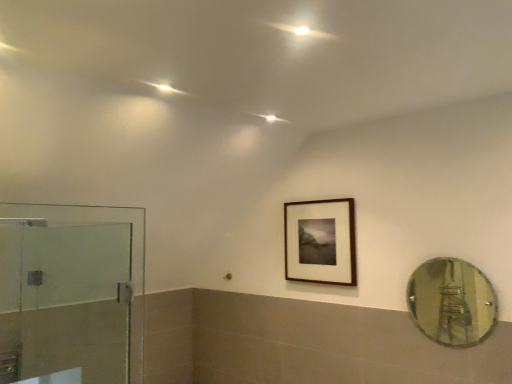
At what (x,y) coordinates should I click in order to perform the action: click on transparent glass shower door at left. Please return your answer as a coordinate pair (x, y). Looking at the image, I should click on (71, 293).

Find the location of a particular element. This screenshot has height=384, width=512. wooden frame at upper center is located at coordinates (320, 241).

From a real-world perspective, between transparent glass shower door at left and wooden frame at upper center, who is vertically lower?

transparent glass shower door at left is physically lower.

Does point (128, 327) come closer to viewer compared to point (314, 231)?

No, it is behind (314, 231).

Are transparent glass shower door at left and wooden frame at upper center beside each other?

They are not placed beside each other.

Which object is wider, transparent glass shower door at left or clear glass mirror at right?

With larger width is transparent glass shower door at left.

Which is behind, point (74, 300) or point (474, 296)?

The point (74, 300) is behind.

Is transparent glass shower door at left inside or outside of clear glass mirror at right?

transparent glass shower door at left is outside clear glass mirror at right.

The width and height of the screenshot is (512, 384). I want to click on screen door that appears above the clear glass mirror at right (from a real-world perspective), so click(71, 293).

Is wooden frame at upper center aimed at transparent glass shower door at left?

Yes, wooden frame at upper center is facing transparent glass shower door at left.

From a real-world perspective, is wooden frame at upper center over transparent glass shower door at left?

Indeed, from a real-world perspective, wooden frame at upper center stands above transparent glass shower door at left.

Based on the photo, which is in front, wooden frame at upper center or transparent glass shower door at left?

transparent glass shower door at left is closer to the camera.

Which is in front, point (315, 202) or point (455, 334)?

The point (455, 334) is closer to the camera.

Between wooden frame at upper center and clear glass mirror at right, which one has less height?

Standing shorter between the two is clear glass mirror at right.

Considering the relative sizes of wooden frame at upper center and clear glass mirror at right in the image provided, is wooden frame at upper center wider than clear glass mirror at right?

Yes.

Based on their sizes in the image, would you say wooden frame at upper center is bigger or smaller than clear glass mirror at right?

Considering their sizes, wooden frame at upper center takes up more space than clear glass mirror at right.

Considering the sizes of objects clear glass mirror at right and wooden frame at upper center in the image provided, who is wider, clear glass mirror at right or wooden frame at upper center?

With larger width is wooden frame at upper center.

Is point (431, 264) closer or farther from the camera than point (339, 207)?

Point (431, 264).

Consider the image. Is clear glass mirror at right not inside wooden frame at upper center?

clear glass mirror at right is positioned outside wooden frame at upper center.

From a real-world perspective, who is located lower, clear glass mirror at right or wooden frame at upper center?

clear glass mirror at right, from a real-world perspective.

At what (x,y) coordinates should I click in order to perform the action: click on mirror on the right of transparent glass shower door at left. Please return your answer as a coordinate pair (x, y). The height and width of the screenshot is (384, 512). Looking at the image, I should click on (452, 302).

Is point (432, 288) behind point (69, 341)?

That is False.

Is transparent glass shower door at left at the back of clear glass mirror at right?

No, transparent glass shower door at left is not at the back of clear glass mirror at right.

The width and height of the screenshot is (512, 384). What are the coordinates of `screen door to the left of wooden frame at upper center` in the screenshot? It's located at (71, 293).

This screenshot has height=384, width=512. What are the coordinates of `mirror below the transparent glass shower door at left (from the image's perspective)` in the screenshot? It's located at (x=452, y=302).

When comparing their distances from transparent glass shower door at left, does wooden frame at upper center or clear glass mirror at right seem further?

clear glass mirror at right is positioned further to the anchor transparent glass shower door at left.

Considering their positions, is clear glass mirror at right positioned further to transparent glass shower door at left than wooden frame at upper center?

clear glass mirror at right.

Based on the photo, looking at the image, which one is located further to wooden frame at upper center, transparent glass shower door at left or clear glass mirror at right?

Based on the image, transparent glass shower door at left appears to be further to wooden frame at upper center.

Which object lies nearer to the anchor point clear glass mirror at right, transparent glass shower door at left or wooden frame at upper center?

Based on the image, wooden frame at upper center appears to be nearer to clear glass mirror at right.

Estimate the real-world distances between objects in this image. Which object is further from wooden frame at upper center, clear glass mirror at right or transparent glass shower door at left?

transparent glass shower door at left.

When comparing their distances from clear glass mirror at right, does wooden frame at upper center or transparent glass shower door at left seem further?

The object further to clear glass mirror at right is transparent glass shower door at left.

The height and width of the screenshot is (384, 512). What are the coordinates of `picture frame between transparent glass shower door at left and clear glass mirror at right` in the screenshot? It's located at (320, 241).